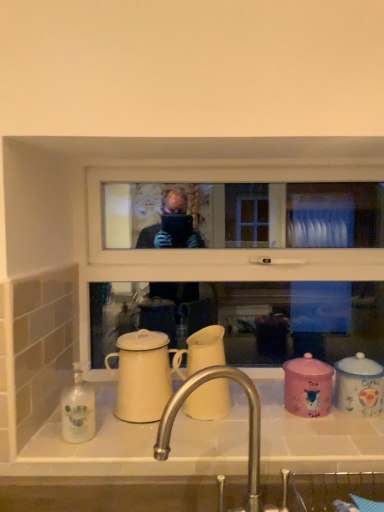
Locate an element on the screen. The width and height of the screenshot is (384, 512). vacant space in front of matte white mug at center, which ranks as the fourth coffee cup in right-to-left order is located at coordinates (135, 445).